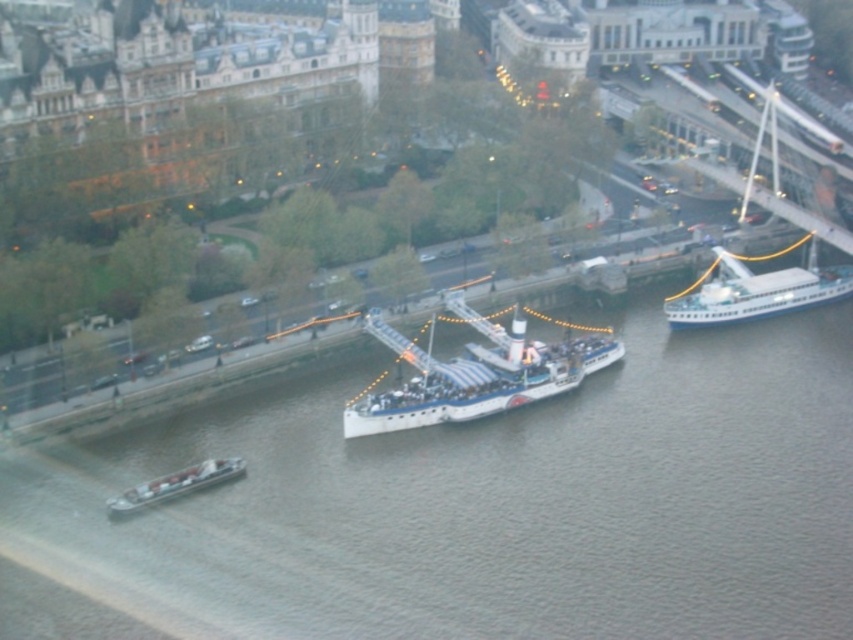
The height and width of the screenshot is (640, 853). What do you see at coordinates (473, 506) in the screenshot?
I see `gray matte water at center` at bounding box center [473, 506].

Who is positioned more to the left, gray matte water at center or white glossy ship at upper right?

gray matte water at center

Between point (312, 516) and point (815, 296), which one is positioned in front?

Point (312, 516) is more forward.

This screenshot has width=853, height=640. I want to click on gray matte water at center, so click(473, 506).

Can you confirm if gray matte water at center is bigger than white glossy boat at center?

Yes.

Can you confirm if gray matte water at center is thinner than white glossy boat at center?

Incorrect, gray matte water at center's width is not less than white glossy boat at center's.

Does point (729, 454) lie in front of point (427, 397)?

Yes, point (729, 454) is in front of point (427, 397).

This screenshot has width=853, height=640. I want to click on gray matte water at center, so click(x=473, y=506).

In the scene shown: Between gray matte water at center and white plastic boat at lower left, which one is positioned higher?

gray matte water at center

The width and height of the screenshot is (853, 640). Describe the element at coordinates (473, 506) in the screenshot. I see `gray matte water at center` at that location.

Locate an element on the screen. Image resolution: width=853 pixels, height=640 pixels. gray matte water at center is located at coordinates (473, 506).